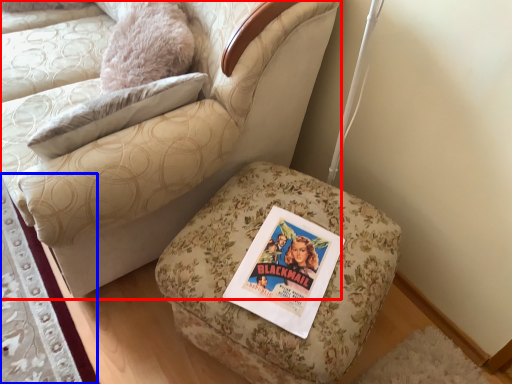
Question: Which of the following is the closest to the observer, chair (highlighted by a red box) or mat (highlighted by a blue box)?

Choices:
 (A) chair
 (B) mat

Answer: (A)